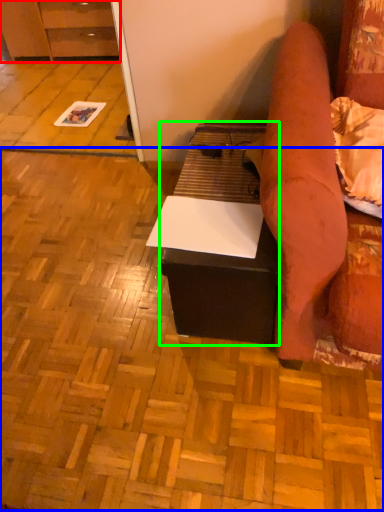
Question: Considering the real-world distances, which object is farthest from cabinetry (highlighted by a red box)? plywood (highlighted by a blue box) or table (highlighted by a green box)?

Choices:
 (A) plywood
 (B) table

Answer: (B)